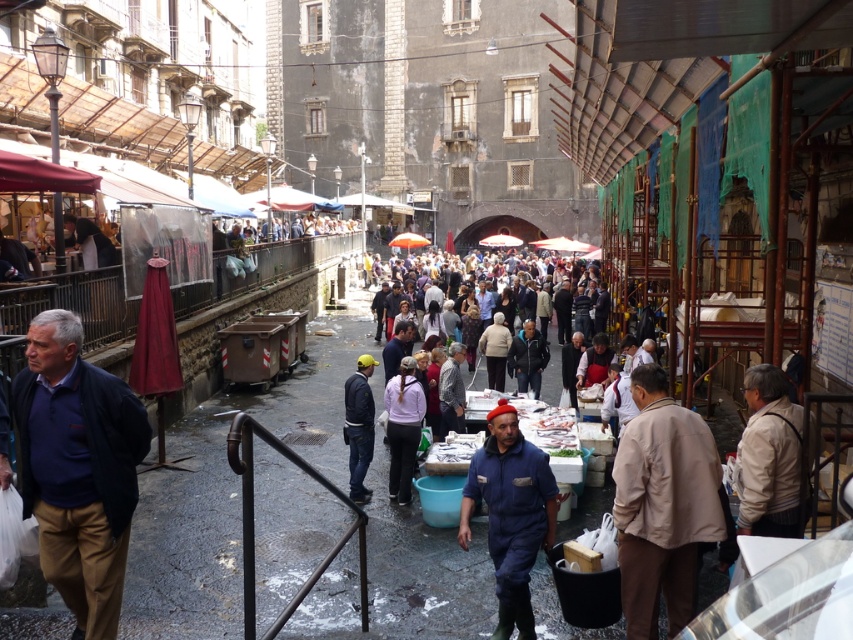
You are a customer at the market and want to buy both the dark blue fabric jacket at left and the light beige sweater at center. You notice that the vendor has placed them in specific positions. Which item is positioned lower in the scene?

The dark blue fabric jacket at left is below the light beige sweater at center, so it is positioned lower in the scene.

You are a customer at the market and want to hang both the dark blue denim jacket at center and the light beige sweater at center on a single hanger. The hanger has a maximum height capacity of 1.2 meters. Can both items fit on the hanger together?

The dark blue denim jacket at center has a greater height compared to light beige sweater at center. However, without knowing the exact heights of each item, it is impossible to determine if their combined height exceeds the hanger limit. Please measure both items individually before deciding.